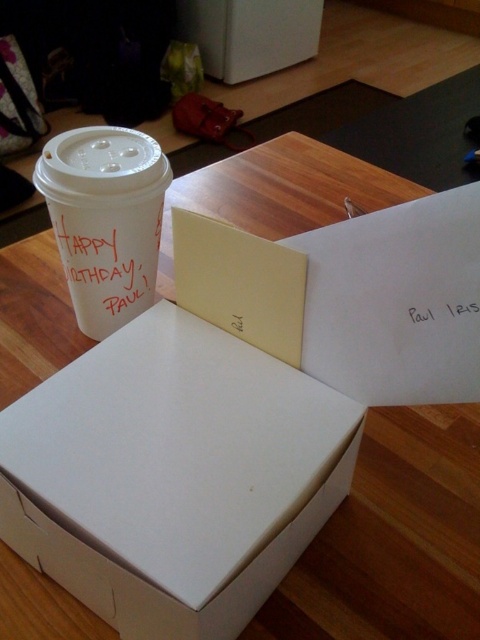
Question: Is white paper cup at upper left closer to the viewer compared to white paper at upper center?

Choices:
 (A) no
 (B) yes

Answer: (B)

Question: Which of the following is the closest to the observer?

Choices:
 (A) (96, 243)
 (B) (437, 317)

Answer: (B)

Question: Does white paper cup at upper left appear on the right side of black paper at upper right?

Choices:
 (A) no
 (B) yes

Answer: (A)

Question: Which of the following is the closest to the observer?

Choices:
 (A) black paper at upper right
 (B) white paper cup at upper left

Answer: (A)

Question: Is white paper cup at upper left closer to the viewer compared to white paper at upper center?

Choices:
 (A) yes
 (B) no

Answer: (A)

Question: Considering the real-world distances, which object is closest to the white paper at upper center?

Choices:
 (A) black paper at upper right
 (B) white paper cup at upper left

Answer: (B)